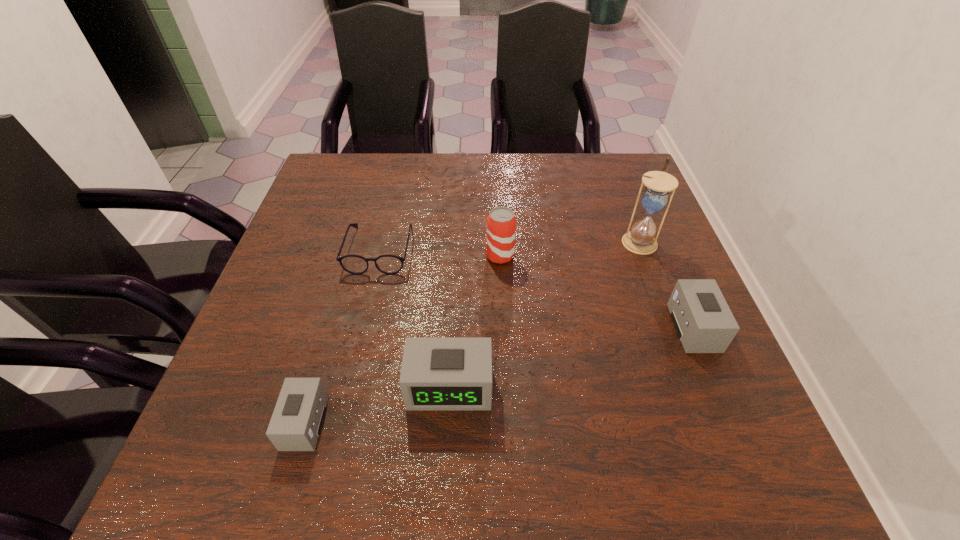
Image resolution: width=960 pixels, height=540 pixels. Find the location of `unoccupied position between the third nearest object and the tallest object`. unoccupied position between the third nearest object and the tallest object is located at coordinates (666, 285).

The image size is (960, 540). I want to click on empty space that is in between the spectacles and the farthest alarm clock, so click(x=537, y=288).

This screenshot has height=540, width=960. I want to click on vacant point located between the second alarm clock from right to left and the farthest alarm clock, so click(x=571, y=357).

I want to click on object that can be found as the second closest to the hourglass, so click(x=501, y=223).

You are a GUI agent. You are given a task and a screenshot of the screen. Output one action in this format:
    pyautogui.click(x=<x>, y=<y>)
    Task: Click on the third closest object to the tallest object
    The height and width of the screenshot is (540, 960).
    Given the screenshot: What is the action you would take?
    pyautogui.click(x=438, y=373)

Find the location of a particular element. The width and height of the screenshot is (960, 540). alarm clock that stands as the closest to the tallest alarm clock is located at coordinates (296, 422).

Locate which alarm clock ranks third in proximity to the hourglass. Please provide its 2D coordinates. Your answer should be formatted as a tuple, i.e. [(x, y)], where the tuple contains the x and y coordinates of a point satisfying the conditions above.

[(296, 422)]

The image size is (960, 540). Identify the location of vacant point that satisfies the following two spatial constraints: 1. on the front-facing side of the second alarm clock from left to right; 2. on the front-facing side of the shortest alarm clock. (448, 422).

Where is `vacant space that satisfies the following two spatial constraints: 1. on the front-facing side of the second alarm clock from left to right; 2. on the front-facing side of the shortest alarm clock`? vacant space that satisfies the following two spatial constraints: 1. on the front-facing side of the second alarm clock from left to right; 2. on the front-facing side of the shortest alarm clock is located at coordinates (448, 422).

Where is `free space in the image that satisfies the following two spatial constraints: 1. on the front-facing side of the rightmost alarm clock; 2. on the front-facing side of the tallest alarm clock`? The width and height of the screenshot is (960, 540). free space in the image that satisfies the following two spatial constraints: 1. on the front-facing side of the rightmost alarm clock; 2. on the front-facing side of the tallest alarm clock is located at coordinates (718, 387).